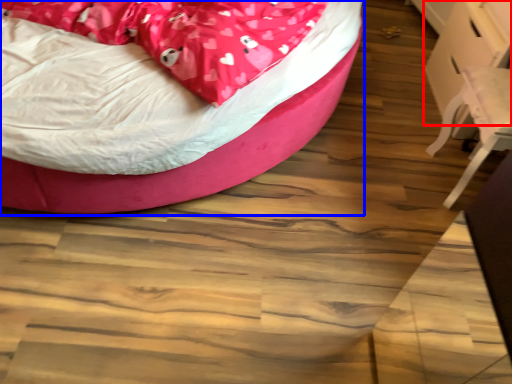
Question: Among these objects, which one is farthest to the camera, table (highlighted by a red box) or bed (highlighted by a blue box)?

Choices:
 (A) table
 (B) bed

Answer: (A)